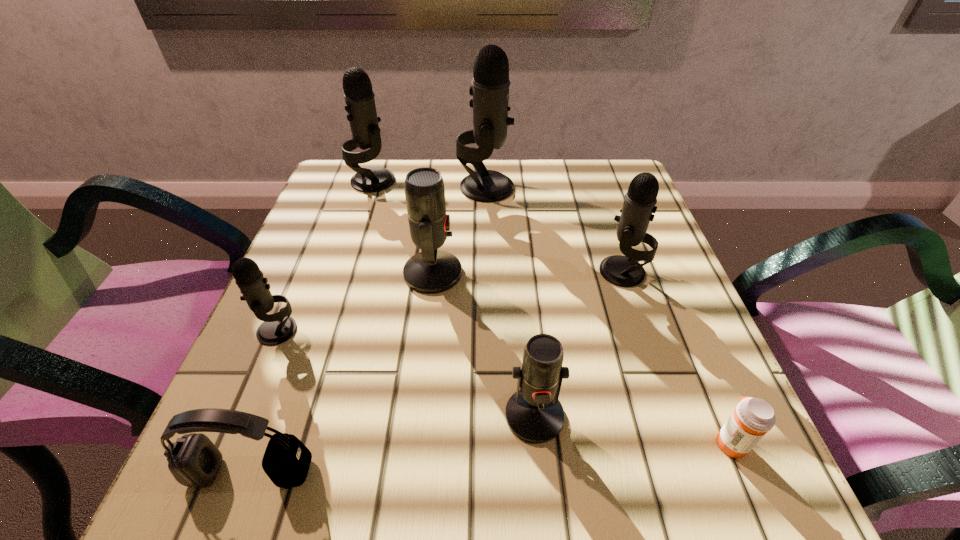
You are a GUI agent. You are given a task and a screenshot of the screen. Output one action in this format:
    pyautogui.click(x=<x>, y=<y>)
    Task: Click on the vacant area that lies between the smaller red microphone and the headset
    
    Given the screenshot: What is the action you would take?
    pyautogui.click(x=393, y=444)

Find the location of `blank region between the farther red microphone and the fifth shortest microphone`. blank region between the farther red microphone and the fifth shortest microphone is located at coordinates point(403,227).

Locate an element on the screen. This screenshot has width=960, height=540. vacant space that's between the smaller red microphone and the biggest black microphone is located at coordinates (510, 301).

The width and height of the screenshot is (960, 540). In order to click on unoccupied area between the third biggest black microphone and the tallest object in this screenshot , I will do `click(554, 230)`.

Where is `free space between the nearest black microphone and the orange medicine`? The width and height of the screenshot is (960, 540). free space between the nearest black microphone and the orange medicine is located at coordinates (504, 387).

Find the location of a particular element. This screenshot has width=960, height=540. free space between the second smallest black microphone and the tallest microphone is located at coordinates (554, 230).

Where is `object identified as the seventh closest to the rightmost microphone`? object identified as the seventh closest to the rightmost microphone is located at coordinates (194, 461).

At what (x,y) coordinates should I click in order to perform the action: click on object that is the second closest to the seventh shortest object. Please return your answer as a coordinate pair (x, y). The width and height of the screenshot is (960, 540). Looking at the image, I should click on (431, 271).

The image size is (960, 540). Find the location of `microphone that stands as the third closest to the farther red microphone`. microphone that stands as the third closest to the farther red microphone is located at coordinates (533, 413).

Identify the location of the fourth closest microphone to the headset. The height and width of the screenshot is (540, 960). (640, 200).